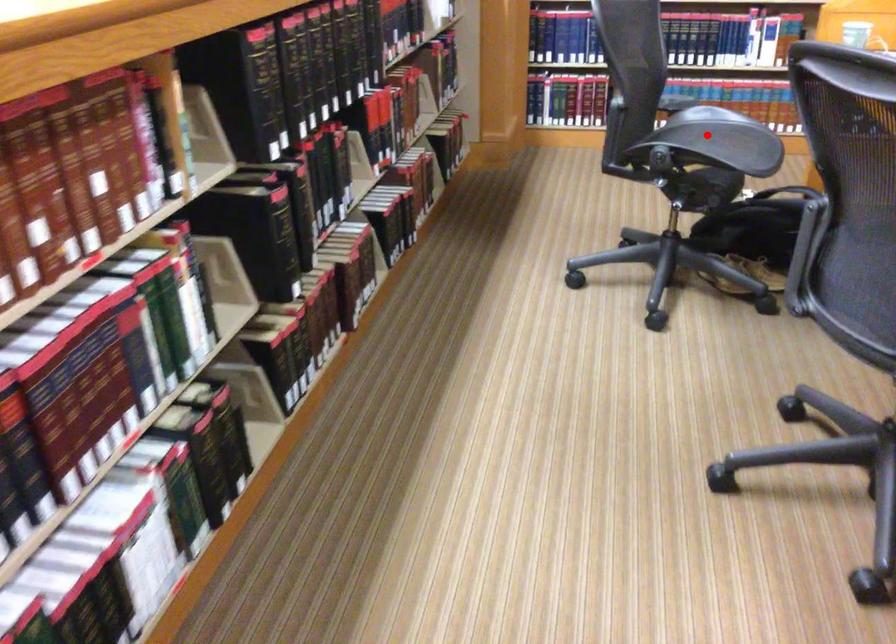
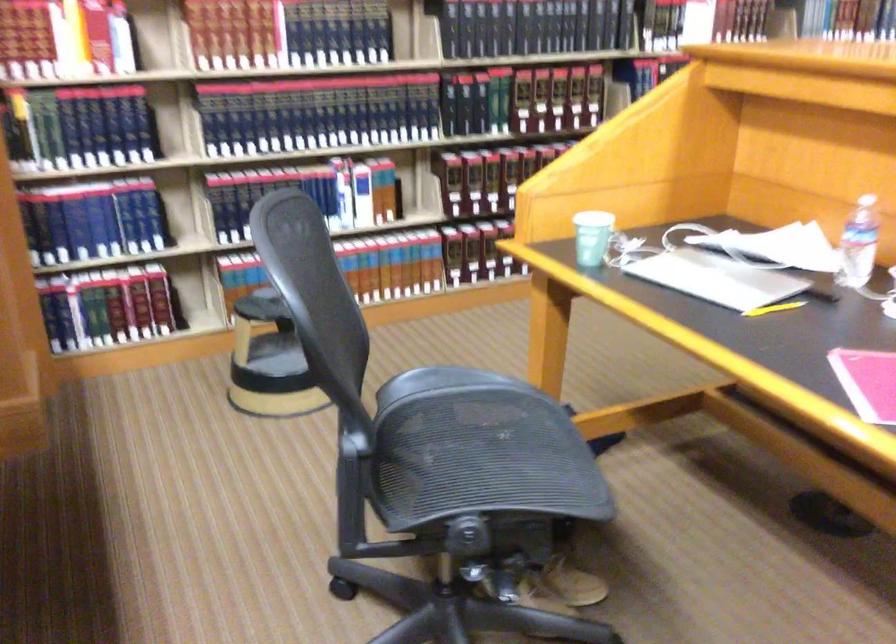
Where in the second image is the point corresponding to the highlighted location from the first image?

(470, 442)